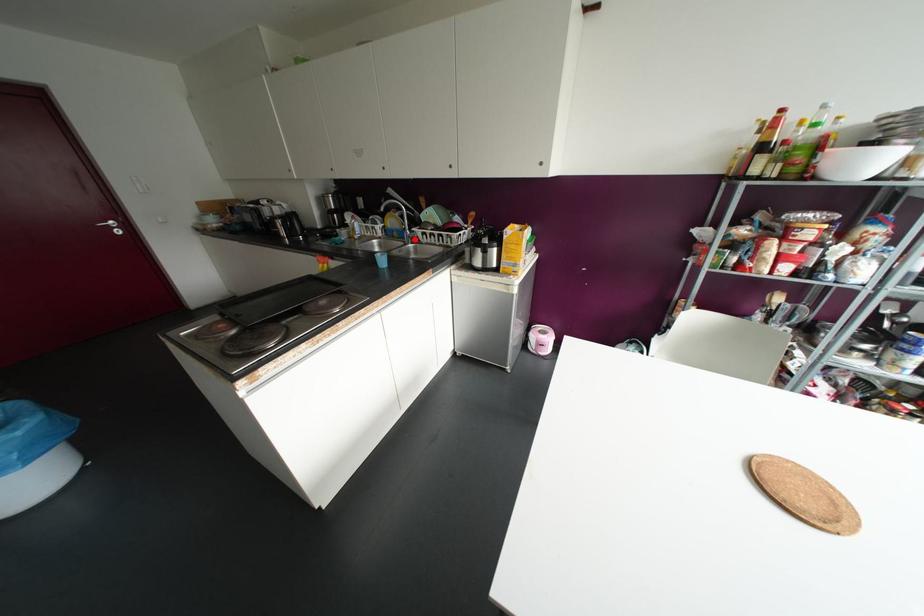
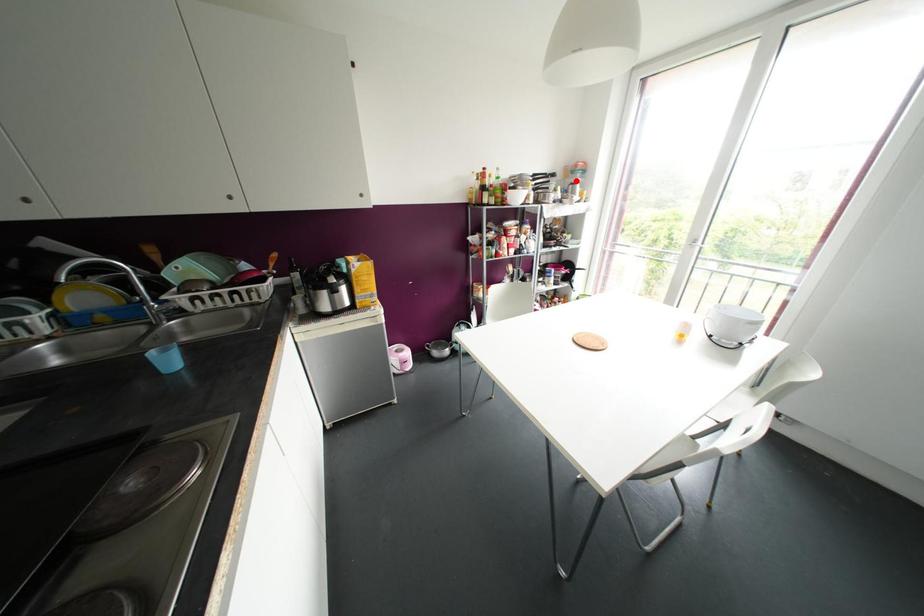
I am providing you with two images of the same scene from different viewpoints. A red point is marked on the first image and another point is marked on the second image. Does the point marked in image1 correspond to the same location as the one in image2?

No